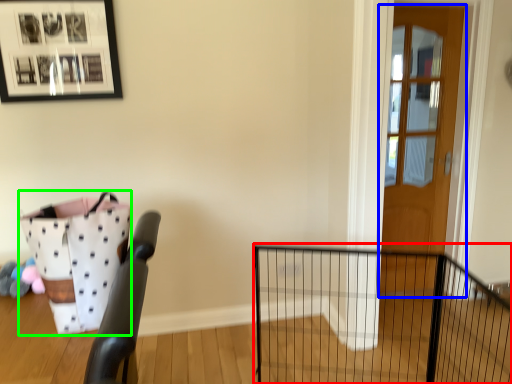
Question: Estimate the real-world distances between objects in this image. Which object is farther from fence (highlighted by a red box), door (highlighted by a blue box) or basket (highlighted by a green box)?

Choices:
 (A) door
 (B) basket

Answer: (B)